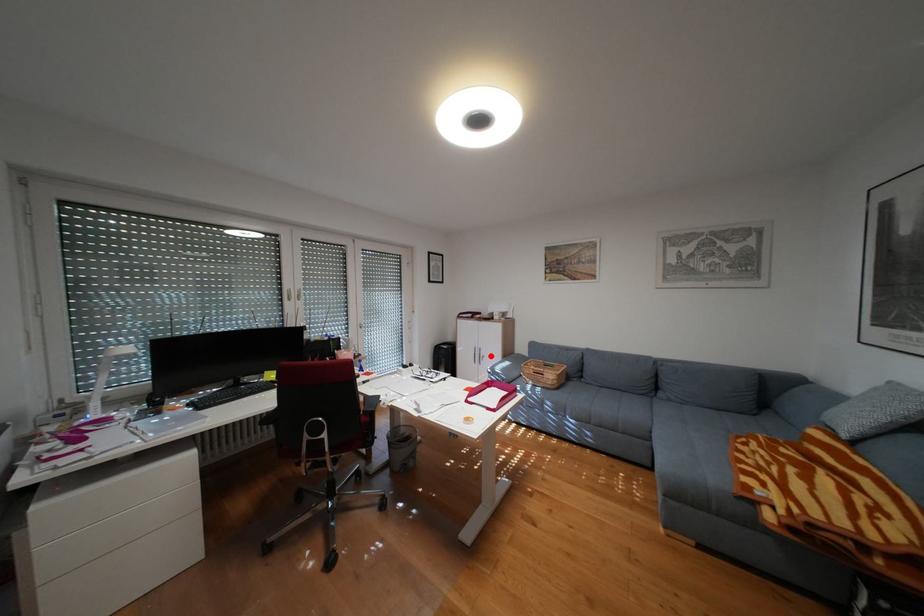
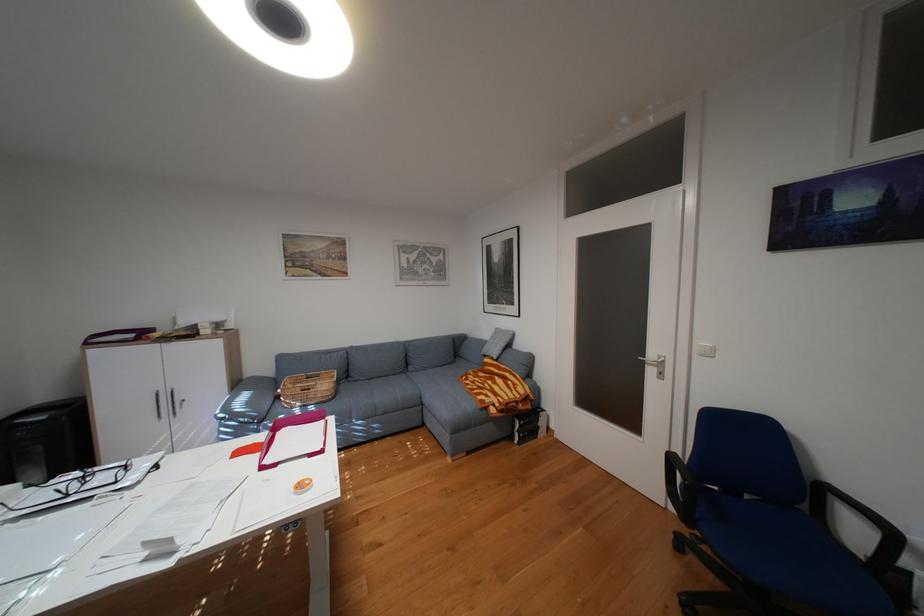
The point at the highlighted location is marked in the first image. Where is the corresponding point in the second image?

(180, 403)